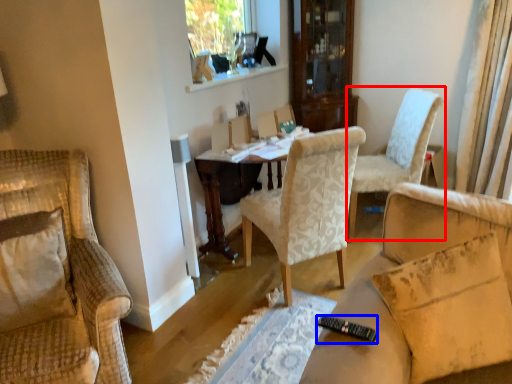
Question: Among these objects, which one is nearest to the camera, chair (highlighted by a red box) or remote control (highlighted by a blue box)?

Choices:
 (A) chair
 (B) remote control

Answer: (B)